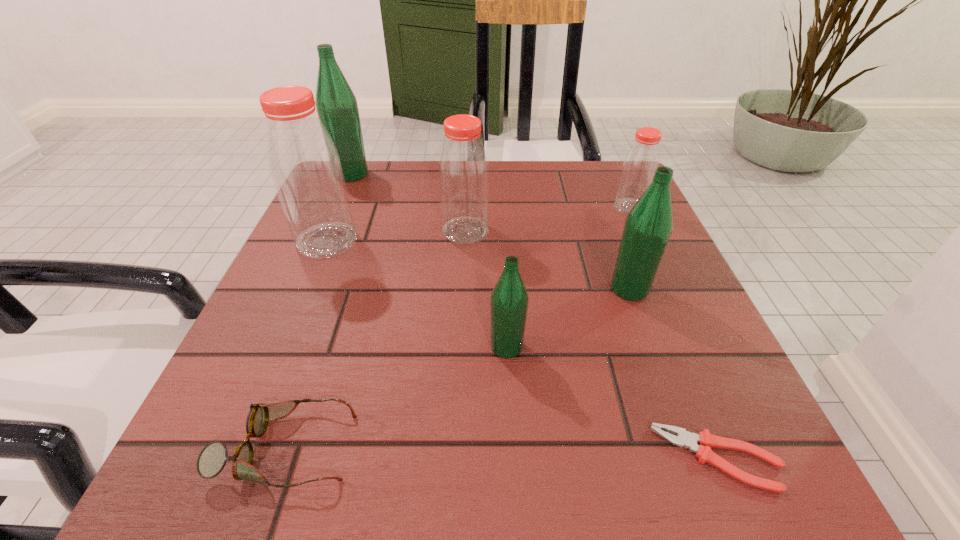
The image size is (960, 540). In order to click on spectacles present at the near edge in this screenshot , I will do `click(212, 459)`.

Locate an element on the screen. This screenshot has width=960, height=540. pliers that is at the near edge is located at coordinates (706, 440).

Identify the location of spectacles present at the left edge. (212, 459).

Locate an element on the screen. pliers present at the right edge is located at coordinates (706, 440).

Where is `object that is at the far left corner`? This screenshot has width=960, height=540. object that is at the far left corner is located at coordinates (337, 108).

You are a GUI agent. You are given a task and a screenshot of the screen. Output one action in this format:
    pyautogui.click(x=<x>, y=<y>)
    Task: Click on the object at the near left corner
    The image size is (960, 540).
    Given the screenshot: What is the action you would take?
    pyautogui.click(x=212, y=459)

At what (x,y) coordinates should I click in order to perform the action: click on object positioned at the far right corner. Please return your answer as a coordinate pair (x, y). The width and height of the screenshot is (960, 540). Looking at the image, I should click on (639, 165).

At what (x,y) coordinates should I click in order to perform the action: click on object located at the near right corner. Please return your answer as a coordinate pair (x, y). The image size is (960, 540). Looking at the image, I should click on (706, 440).

In the image, there is a desktop. Where is `vacant area at the far edge`? The height and width of the screenshot is (540, 960). vacant area at the far edge is located at coordinates (410, 180).

Locate an element on the screen. The image size is (960, 540). free space at the near edge is located at coordinates (403, 455).